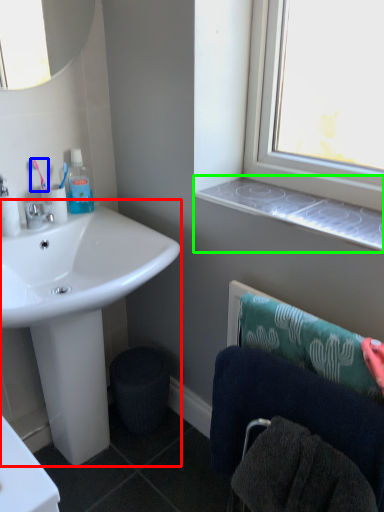
Question: Considering the real-world distances, which object is farthest from sink (highlighted by a red box)? toothbrush (highlighted by a blue box) or window sill (highlighted by a green box)?

Choices:
 (A) toothbrush
 (B) window sill

Answer: (B)